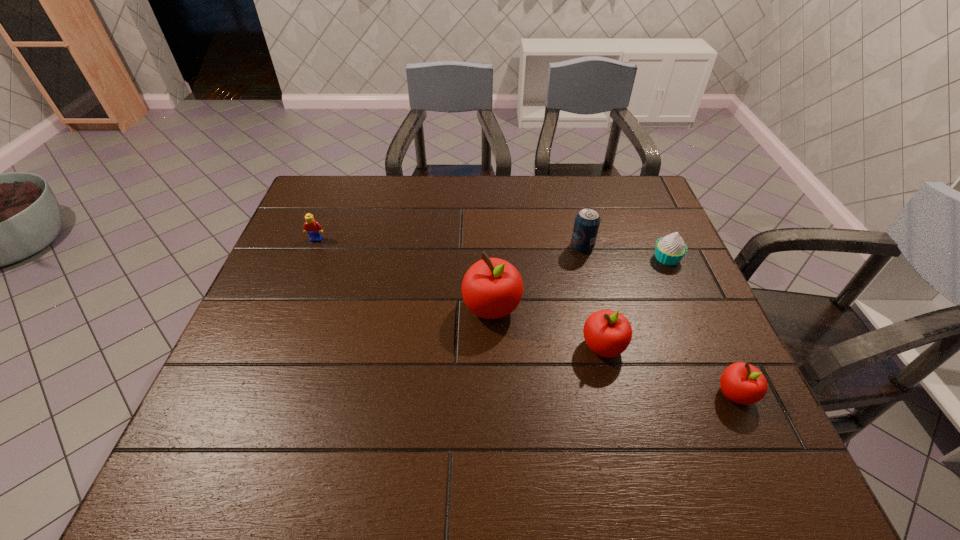
This screenshot has width=960, height=540. In order to click on free space located on the back of the rightmost apple in this screenshot , I will do `click(686, 287)`.

Locate an element on the screen. blank space located on the back of the cupcake is located at coordinates (654, 228).

This screenshot has width=960, height=540. I want to click on vacant space located on the right of the pop soda, so click(663, 246).

Locate an element on the screen. This screenshot has width=960, height=540. blank area located on the front-facing side of the Lego is located at coordinates (306, 266).

Find the location of a particular element. object at the near edge is located at coordinates (742, 383).

You are a GUI agent. You are given a task and a screenshot of the screen. Output one action in this format:
    pyautogui.click(x=<x>, y=<y>)
    Task: Click on the object at the left edge
    
    Given the screenshot: What is the action you would take?
    pyautogui.click(x=313, y=228)

Identify the location of apple present at the right edge. (742, 383).

Locate an element on the screen. cupcake that is at the right edge is located at coordinates (669, 250).

The width and height of the screenshot is (960, 540). In order to click on object that is at the near right corner in this screenshot , I will do `click(742, 383)`.

Where is `vacant space at the far edge of the desktop`? The width and height of the screenshot is (960, 540). vacant space at the far edge of the desktop is located at coordinates (380, 213).